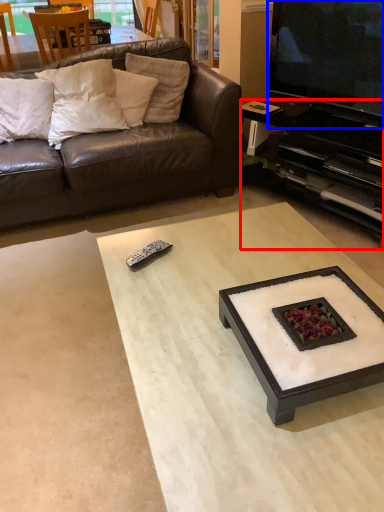
Question: Among these objects, which one is farthest to the camera, cabinetry (highlighted by a red box) or television (highlighted by a blue box)?

Choices:
 (A) cabinetry
 (B) television

Answer: (A)